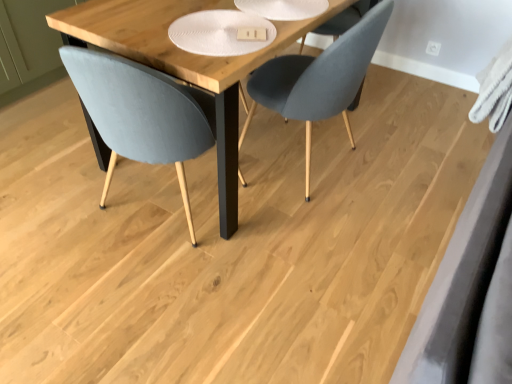
Question: Does velvet grey chair at center, the first chair in the right-to-left sequence, have a greater width compared to matte gray chair at left, which is the second chair from right to left?

Choices:
 (A) yes
 (B) no

Answer: (B)

Question: Is velvet grey chair at center, acting as the second chair starting from the left, smaller than matte gray chair at left, which is the second chair from right to left?

Choices:
 (A) yes
 (B) no

Answer: (B)

Question: Does velvet grey chair at center, acting as the second chair starting from the left, touch matte gray chair at left, which is the second chair from right to left?

Choices:
 (A) no
 (B) yes

Answer: (A)

Question: From the image's perspective, is velvet grey chair at center, the first chair in the right-to-left sequence, beneath matte gray chair at left, which is counted as the first chair, starting from the left?

Choices:
 (A) no
 (B) yes

Answer: (A)

Question: Is the depth of velvet grey chair at center, acting as the second chair starting from the left, greater than that of matte gray chair at left, which is counted as the first chair, starting from the left?

Choices:
 (A) yes
 (B) no

Answer: (A)

Question: Is velvet grey chair at center, the first chair in the right-to-left sequence, inside or outside of wooden table at center?

Choices:
 (A) inside
 (B) outside

Answer: (A)

Question: Is velvet grey chair at center, acting as the second chair starting from the left, taller or shorter than wooden table at center?

Choices:
 (A) short
 (B) tall

Answer: (B)

Question: From a real-world perspective, is velvet grey chair at center, acting as the second chair starting from the left, above or below wooden table at center?

Choices:
 (A) below
 (B) above

Answer: (B)

Question: Based on their positions, is velvet grey chair at center, acting as the second chair starting from the left, located to the left or right of wooden table at center?

Choices:
 (A) right
 (B) left

Answer: (A)

Question: In terms of width, does wooden table at center look wider or thinner when compared to matte gray chair at left, which is counted as the first chair, starting from the left?

Choices:
 (A) thin
 (B) wide

Answer: (B)

Question: From their relative heights in the image, would you say wooden table at center is taller or shorter than matte gray chair at left, which is the second chair from right to left?

Choices:
 (A) short
 (B) tall

Answer: (A)

Question: From the image's perspective, relative to matte gray chair at left, which is counted as the first chair, starting from the left, is wooden table at center above or below?

Choices:
 (A) above
 (B) below

Answer: (A)

Question: Visually, is wooden table at center positioned to the left or to the right of matte gray chair at left, which is the second chair from right to left?

Choices:
 (A) left
 (B) right

Answer: (B)

Question: Would you say matte gray chair at left, which is counted as the first chair, starting from the left, is inside or outside velvet grey chair at center, acting as the second chair starting from the left?

Choices:
 (A) outside
 (B) inside

Answer: (A)

Question: Considering the relative positions of matte gray chair at left, which is counted as the first chair, starting from the left, and velvet grey chair at center, the first chair in the right-to-left sequence, in the image provided, is matte gray chair at left, which is counted as the first chair, starting from the left, to the left or to the right of velvet grey chair at center, the first chair in the right-to-left sequence,?

Choices:
 (A) left
 (B) right

Answer: (A)